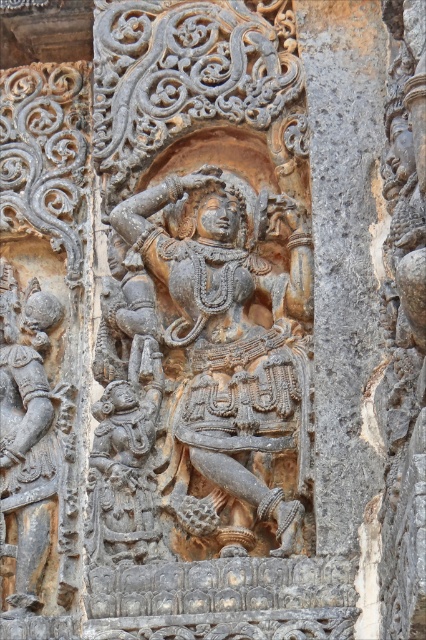
Question: Which point is closer to the camera?

Choices:
 (A) carved stone dancer at center
 (B) gray stone warrior at left
 (C) gray stone pillar at center

Answer: (C)

Question: Is carved stone dancer at center wider than gray stone warrior at left?

Choices:
 (A) no
 (B) yes

Answer: (B)

Question: Among these points, which one is farthest from the camera?

Choices:
 (A) (28, 426)
 (B) (238, 413)
 (C) (339, 364)

Answer: (A)

Question: Which point appears closest to the camera in this image?

Choices:
 (A) (294, 346)
 (B) (20, 556)

Answer: (A)

Question: Can you confirm if gray stone pillar at center is positioned to the left of gray stone warrior at left?

Choices:
 (A) no
 (B) yes

Answer: (A)

Question: From the image, what is the correct spatial relationship of carved stone dancer at center in relation to gray stone warrior at left?

Choices:
 (A) below
 (B) above

Answer: (B)